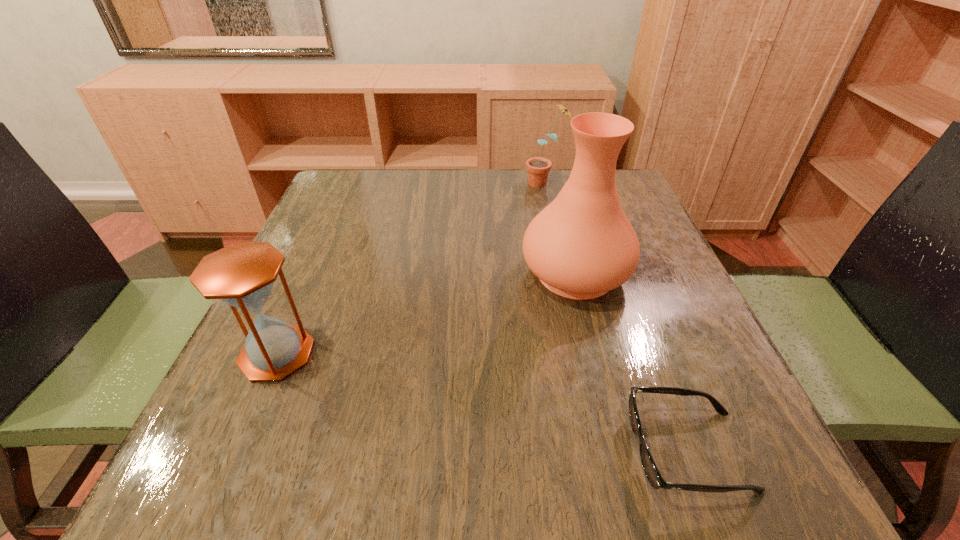
I want to click on free space located 0.050m on the flower of the farthest object, so click(506, 183).

Where is `free space located 0.120m on the back of the leftmost object`? The image size is (960, 540). free space located 0.120m on the back of the leftmost object is located at coordinates (308, 284).

Identify the location of vacant space located 0.160m on the lenses of the shortest object. (517, 451).

Locate an element on the screen. This screenshot has height=540, width=960. vacant space positioned 0.220m on the lenses of the shortest object is located at coordinates (474, 451).

Locate an element on the screen. This screenshot has width=960, height=540. vacant space situated on the lenses of the shortest object is located at coordinates (403, 451).

Find the location of `object located in the far edge section of the desktop`. object located in the far edge section of the desktop is located at coordinates (538, 168).

Locate an element on the screen. object situated at the near edge is located at coordinates (652, 473).

In order to click on object that is at the left edge in this screenshot , I will do `click(242, 275)`.

Locate an element on the screen. The width and height of the screenshot is (960, 540). vase located at the right edge is located at coordinates (582, 245).

At what (x,y) coordinates should I click in order to perform the action: click on spectacles that is at the right edge. Please return your answer as a coordinate pair (x, y). The width and height of the screenshot is (960, 540). Looking at the image, I should click on (652, 473).